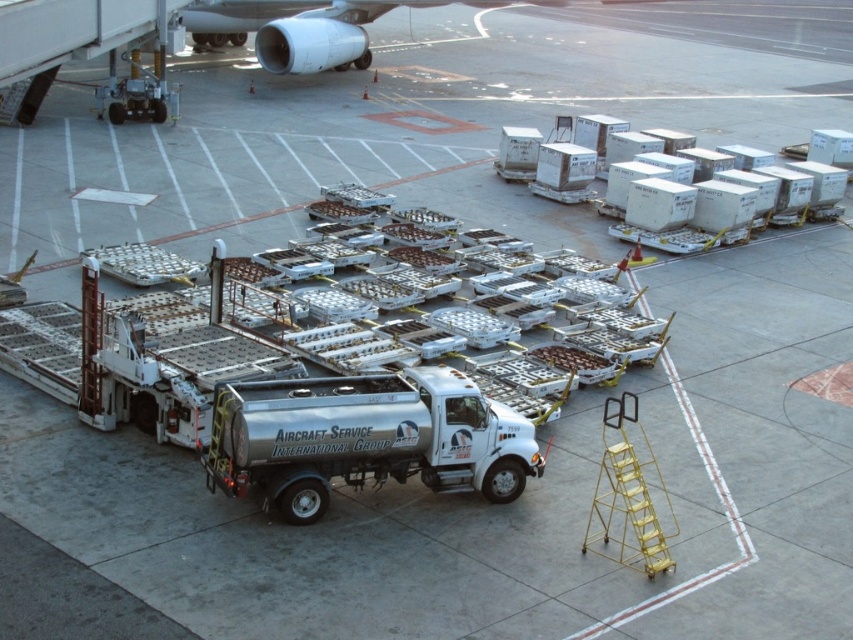
Between point (358, 448) and point (339, 0), which one is positioned behind?

Point (339, 0)

Can you confirm if silver metallic truck at center is bigger than metallic silver engine at upper center?

No.

Who is more distant from viewer, (251,390) or (306,65)?

The point (306,65) is behind.

The width and height of the screenshot is (853, 640). Find the location of `silver metallic truck at center`. silver metallic truck at center is located at coordinates (364, 436).